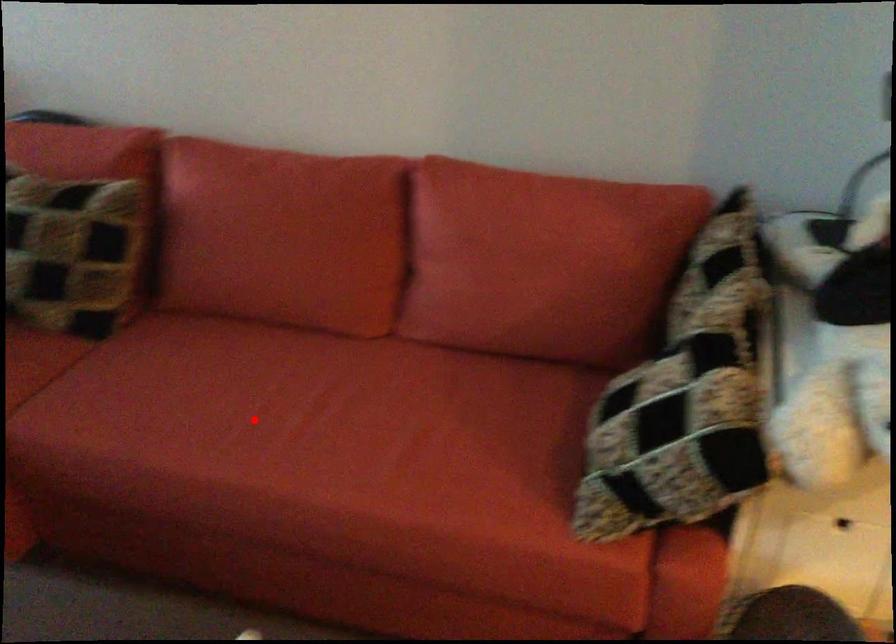
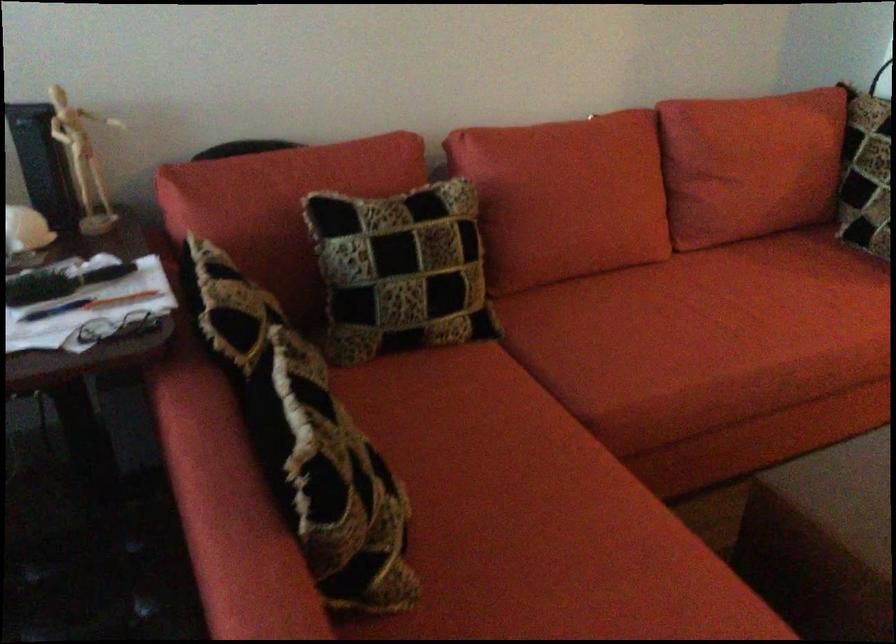
Where in the second image is the point corresponding to the highlighted location from the first image?

(726, 323)